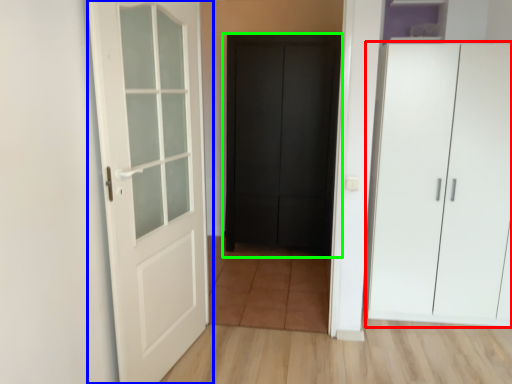
Question: Based on their relative distances, which object is farther from cupboard (highlighted by a red box)? Choose from door (highlighted by a blue box) and door (highlighted by a green box).

Choices:
 (A) door
 (B) door

Answer: (A)